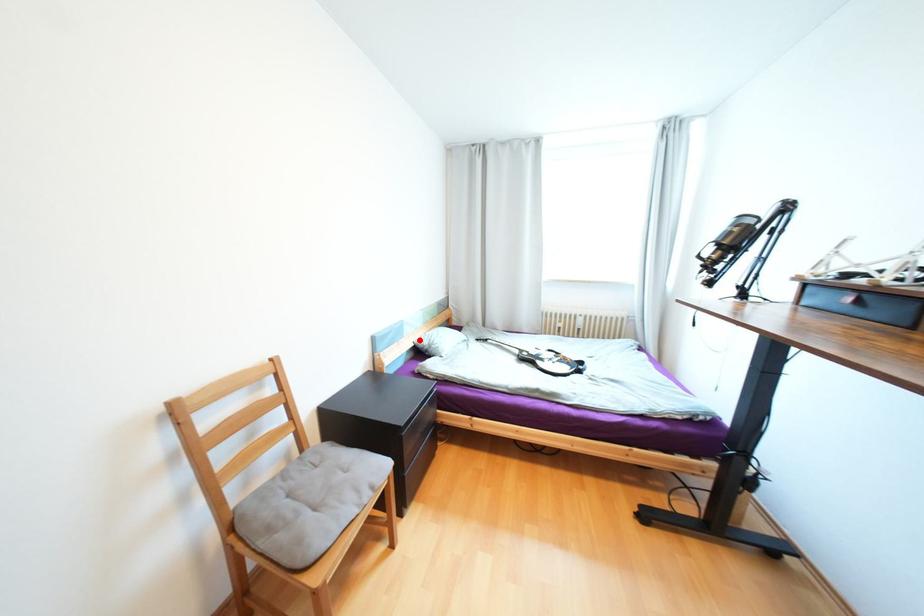
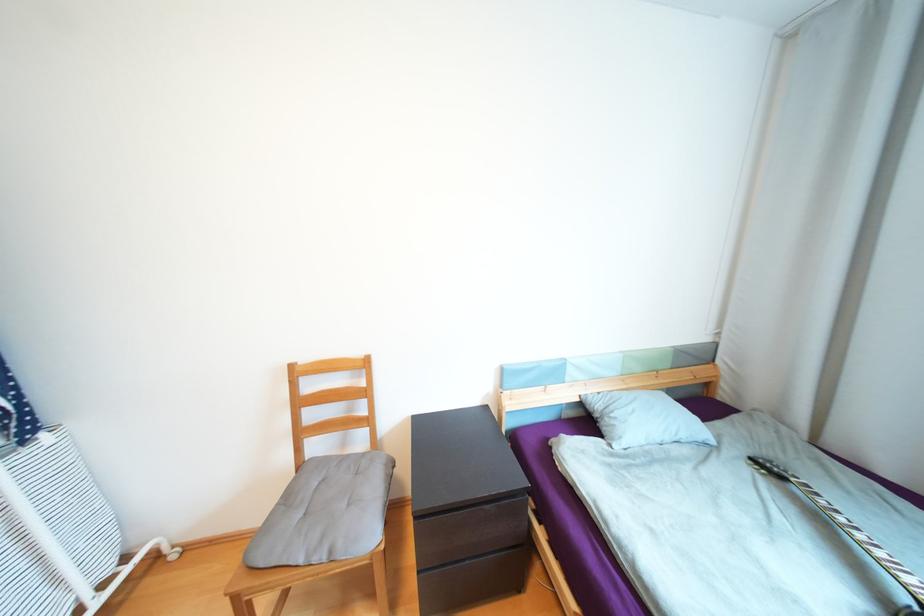
Find the pixel in the second image that matches the highlighted location in the first image.

(588, 392)